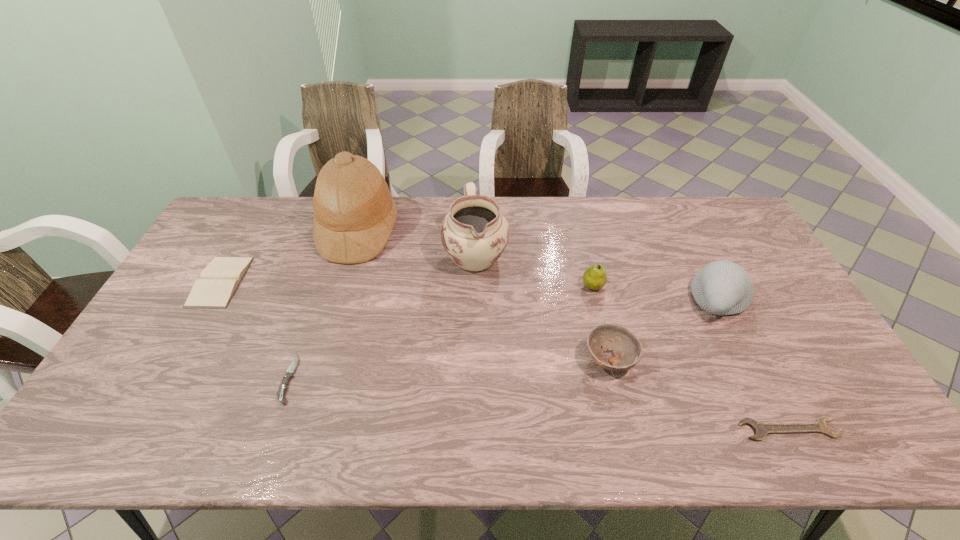
The height and width of the screenshot is (540, 960). In order to click on free spot between the pocketknife and the fifth shortest object in this screenshot , I will do `click(442, 333)`.

Image resolution: width=960 pixels, height=540 pixels. Identify the location of vacant space that is in between the tallest object and the third shortest object. (290, 256).

Locate which object ranks in proximity to the second tallest object. Please provide its 2D coordinates. Your answer should be formatted as a tuple, i.e. [(x, y)], where the tuple contains the x and y coordinates of a point satisfying the conditions above.

[(354, 213)]

Select which object is the seventh closest to the sixth shortest object. Please provide its 2D coordinates. Your answer should be formatted as a tuple, i.e. [(x, y)], where the tuple contains the x and y coordinates of a point satisfying the conditions above.

[(219, 280)]

Find the location of a particular element. This screenshot has width=960, height=540. vacant region that satisfies the following two spatial constraints: 1. on the front-facing side of the hat; 2. on the right side of the fifth tallest object is located at coordinates (321, 360).

Locate an element on the screen. Image resolution: width=960 pixels, height=540 pixels. vacant space that satisfies the following two spatial constraints: 1. on the front-facing side of the hat; 2. on the left side of the fifth shortest object is located at coordinates [x=342, y=286].

The width and height of the screenshot is (960, 540). Find the location of `vacant space that satisfies the following two spatial constraints: 1. on the front side of the fifth shortest object; 2. on the right side of the sixth shortest object`. vacant space that satisfies the following two spatial constraints: 1. on the front side of the fifth shortest object; 2. on the right side of the sixth shortest object is located at coordinates (596, 300).

You are a GUI agent. You are given a task and a screenshot of the screen. Output one action in this format:
    pyautogui.click(x=<x>, y=<y>)
    Task: Click on the vacant region that satisfies the following two spatial constraints: 1. on the front-facing side of the tallest object; 2. on the right side of the fifth tallest object
    The image size is (960, 540).
    Given the screenshot: What is the action you would take?
    pyautogui.click(x=321, y=360)

This screenshot has height=540, width=960. In order to click on free space that satisfies the following two spatial constraints: 1. on the back side of the beanie; 2. on the right side of the bowl in this screenshot , I will do `click(595, 300)`.